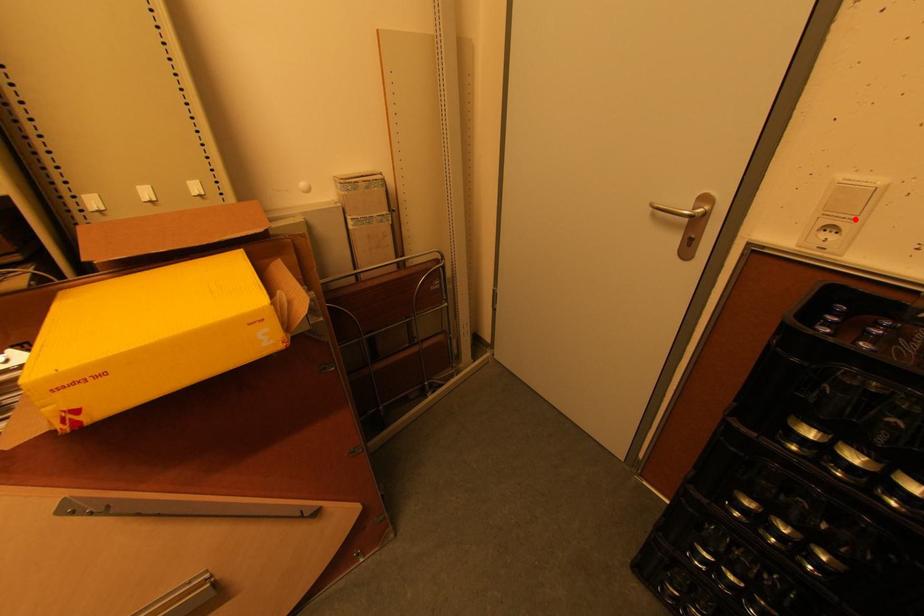
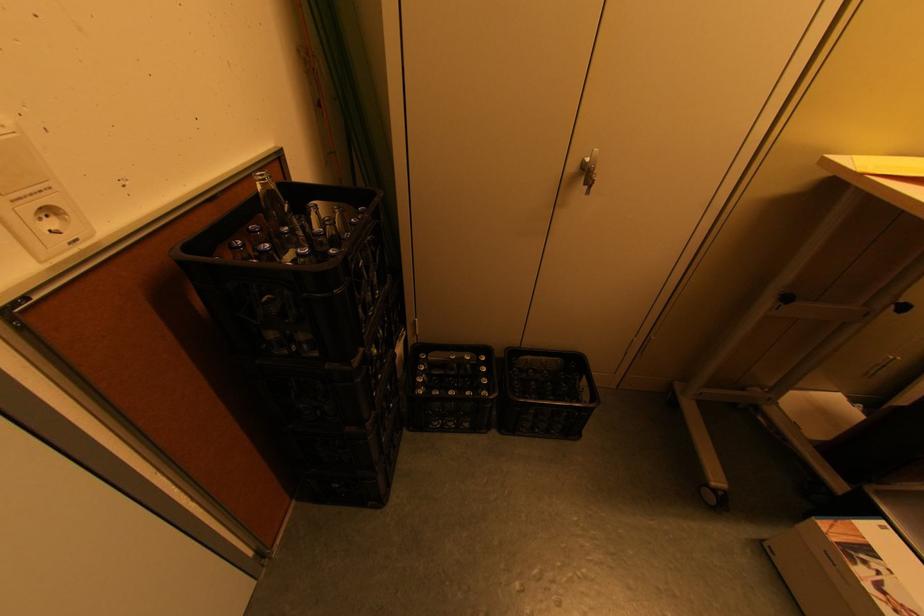
Locate, in the second image, the point that corresponds to the highlighted location in the first image.

(54, 188)